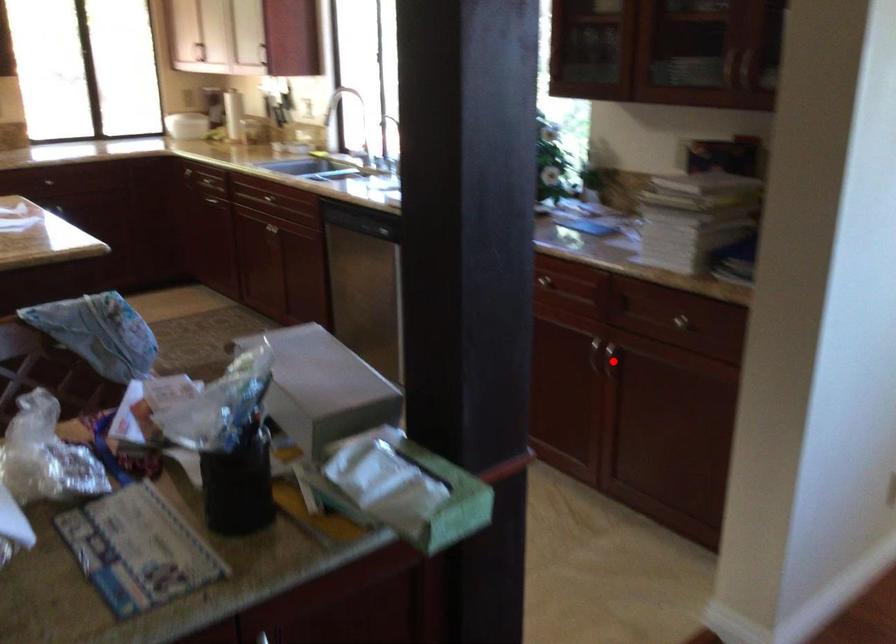
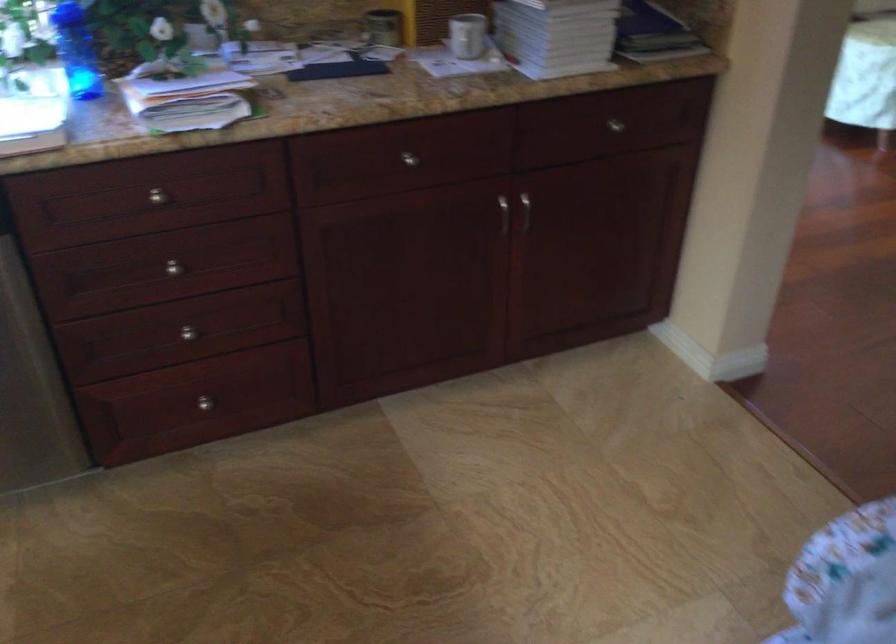
In the second image, find the point that corresponds to the highlighted location in the first image.

(515, 213)